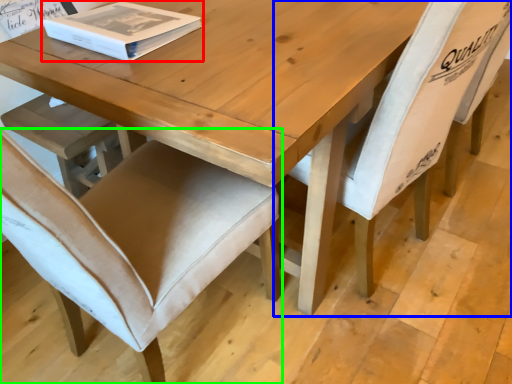
Question: Estimate the real-world distances between objects in this image. Which object is farther from box (highlighted by a red box), chair (highlighted by a blue box) or chair (highlighted by a green box)?

Choices:
 (A) chair
 (B) chair

Answer: (A)